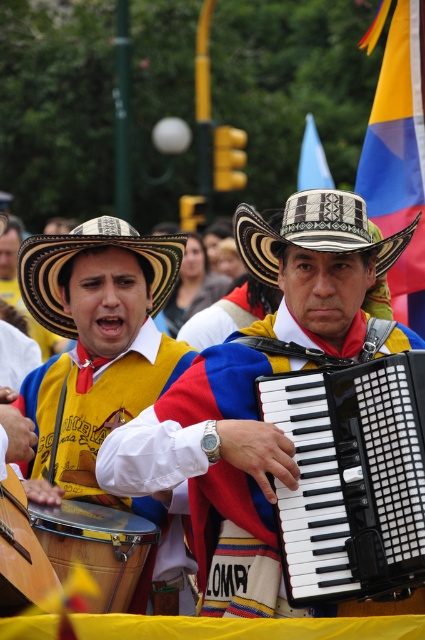
You are a photographer trying to capture the vibrant street scene. You notice the matte yellow vest at center and the white woven straw hat at center. Which item has a smaller width when viewed from your camera angle?

The matte yellow vest at center is thinner than the white woven straw hat at center, so the matte yellow vest at center has a smaller width.

You are a photographer planning to capture a closeup shot of the black plastic accordion at center and the natural straw cowboy hat at center. Based on their sizes, which object should you focus on first if you want to ensure both fit in the frame without cropping?

The black plastic accordion at center has a lesser width compared to natural straw cowboy hat at center, so you should focus on the natural straw cowboy hat at center first to ensure it fits in the frame, then adjust to include the smaller black plastic accordion at center.

You are a photographer standing in the middle of the street, and you want to capture a photo of the yellow fabric flag at upper right. Based on its position, which direction should you look to locate it?

The yellow fabric flag at upper right is located at point (399, 156), so you should look towards the upper right direction to locate it.